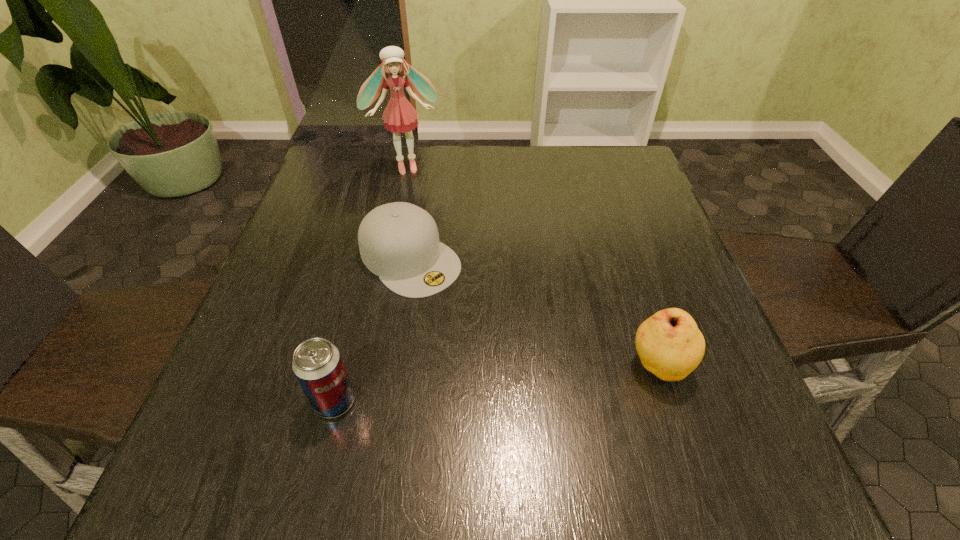
Locate an element on the screen. The image size is (960, 540). object located at the near right corner is located at coordinates (670, 345).

Identify the location of free space at the far edge of the desktop. (576, 165).

Locate an element on the screen. Image resolution: width=960 pixels, height=540 pixels. vacant space at the near edge of the desktop is located at coordinates (548, 391).

Locate an element on the screen. This screenshot has width=960, height=540. vacant region at the left edge of the desktop is located at coordinates (301, 216).

At what (x,y) coordinates should I click in order to perform the action: click on free space at the right edge. Please return your answer as a coordinate pair (x, y). Looking at the image, I should click on (600, 209).

Identify the location of free space at the far left corner. The image size is (960, 540). tap(358, 165).

The height and width of the screenshot is (540, 960). I want to click on vacant space at the far right corner of the desktop, so [x=621, y=190].

At what (x,y) coordinates should I click in order to perform the action: click on vacant space in between the cap and the rightmost object. Please return your answer as a coordinate pair (x, y). Looking at the image, I should click on (535, 312).

This screenshot has width=960, height=540. I want to click on free space between the shortest object and the pear, so click(x=535, y=312).

Find the location of a particular element. The width and height of the screenshot is (960, 540). vacant space that's between the beer can and the shortest object is located at coordinates (372, 330).